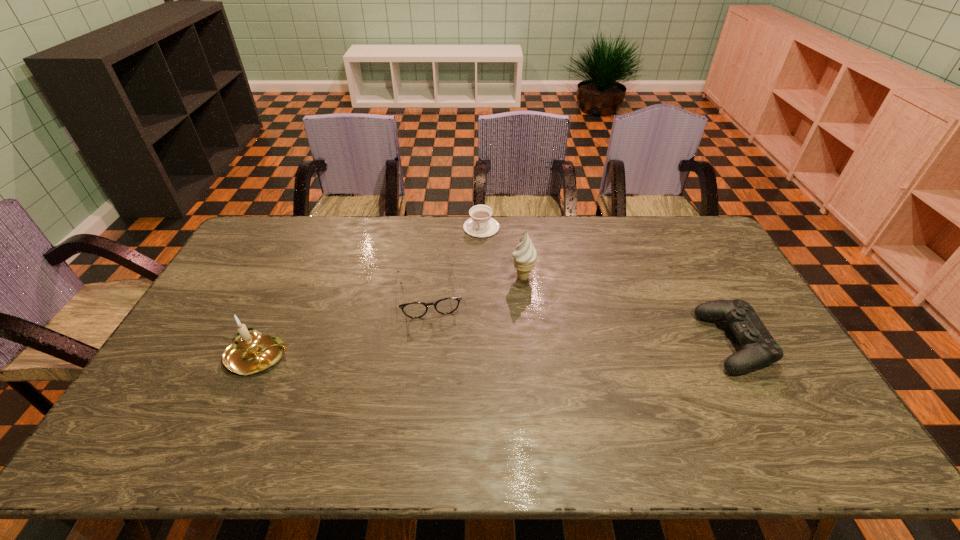
At what (x,y) coordinates should I click in order to perform the action: click on free space located 0.100m on the front-facing side of the fourth object from left to right. Please return your answer as a coordinate pair (x, y). The width and height of the screenshot is (960, 540). Looking at the image, I should click on (497, 300).

Locate an element on the screen. blank space located 0.060m on the front-facing side of the fourth object from left to right is located at coordinates [505, 294].

Locate an element on the screen. This screenshot has height=540, width=960. free location located on the handle side of the teacup is located at coordinates (463, 301).

This screenshot has width=960, height=540. In order to click on free location located 0.150m on the handle side of the teacup in this screenshot , I will do `click(472, 264)`.

The image size is (960, 540). What are the coordinates of `vacant space located on the handle side of the teacup` in the screenshot? It's located at (461, 310).

What are the coordinates of `vacant space located through the lenses of the spectacles` in the screenshot? It's located at (438, 356).

You are a GUI agent. You are given a task and a screenshot of the screen. Output one action in this format:
    pyautogui.click(x=<x>, y=<y>)
    Task: Click on the vacant area situated 0.220m through the lenses of the spectacles
    The height and width of the screenshot is (540, 960).
    Given the screenshot: What is the action you would take?
    pyautogui.click(x=441, y=380)

Where is `vacant space located through the lenses of the spectacles`? The height and width of the screenshot is (540, 960). vacant space located through the lenses of the spectacles is located at coordinates (443, 392).

Locate an element on the screen. The image size is (960, 540). object that is positioned at the far edge is located at coordinates (481, 225).

The width and height of the screenshot is (960, 540). What are the coordinates of `object that is positioned at the left edge` in the screenshot? It's located at (251, 352).